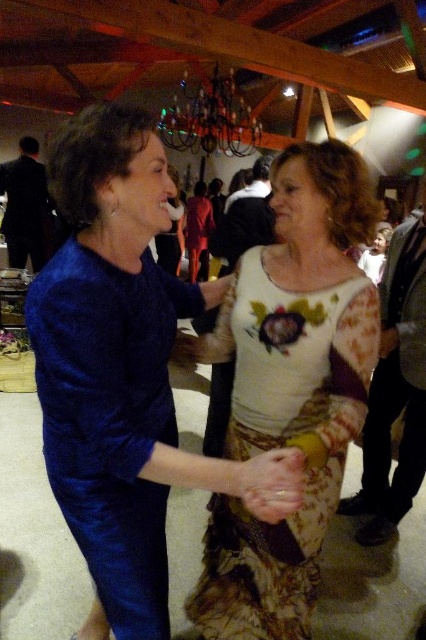
Question: Estimate the real-world distances between objects in this image. Which object is closer to the floral-patterned fabric dress at center?

Choices:
 (A) matte blue dress at center
 (B) metallic chandelier at upper center

Answer: (A)

Question: Estimate the real-world distances between objects in this image. Which object is farther from the matte blue dress at center?

Choices:
 (A) floral-patterned fabric dress at center
 (B) metallic chandelier at upper center

Answer: (B)

Question: Is floral-patterned fabric dress at center behind metallic chandelier at upper center?

Choices:
 (A) yes
 (B) no

Answer: (B)

Question: Estimate the real-world distances between objects in this image. Which object is closer to the floral-patterned fabric dress at center?

Choices:
 (A) metallic chandelier at upper center
 (B) matte blue dress at center

Answer: (B)

Question: Can you confirm if floral-patterned fabric dress at center is positioned to the right of metallic chandelier at upper center?

Choices:
 (A) no
 (B) yes

Answer: (B)

Question: Is matte blue dress at center thinner than metallic chandelier at upper center?

Choices:
 (A) no
 (B) yes

Answer: (B)